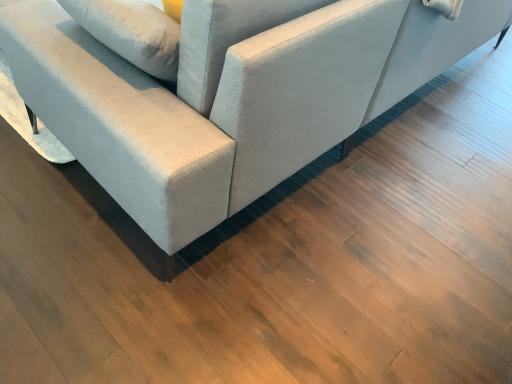
The width and height of the screenshot is (512, 384). I want to click on suede-like gray couch at lower left, so click(x=229, y=95).

What is the approximate height of suede-like gray couch at lower left?

84.82 centimeters.

The image size is (512, 384). What do you see at coordinates (229, 95) in the screenshot? I see `suede-like gray couch at lower left` at bounding box center [229, 95].

Find the location of a particular element. The image size is (512, 384). suede-like gray couch at lower left is located at coordinates (229, 95).